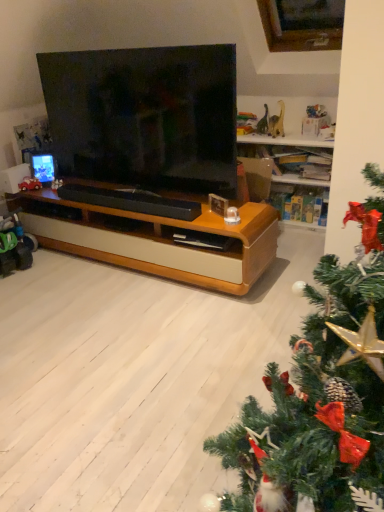
You are a GUI agent. You are given a task and a screenshot of the screen. Output one action in this format:
    pyautogui.click(x=<x>, y=<y>)
    Task: Click on the free point below black matte soundbar at center (from a real-world perspective)
    
    Given the screenshot: What is the action you would take?
    pyautogui.click(x=121, y=263)